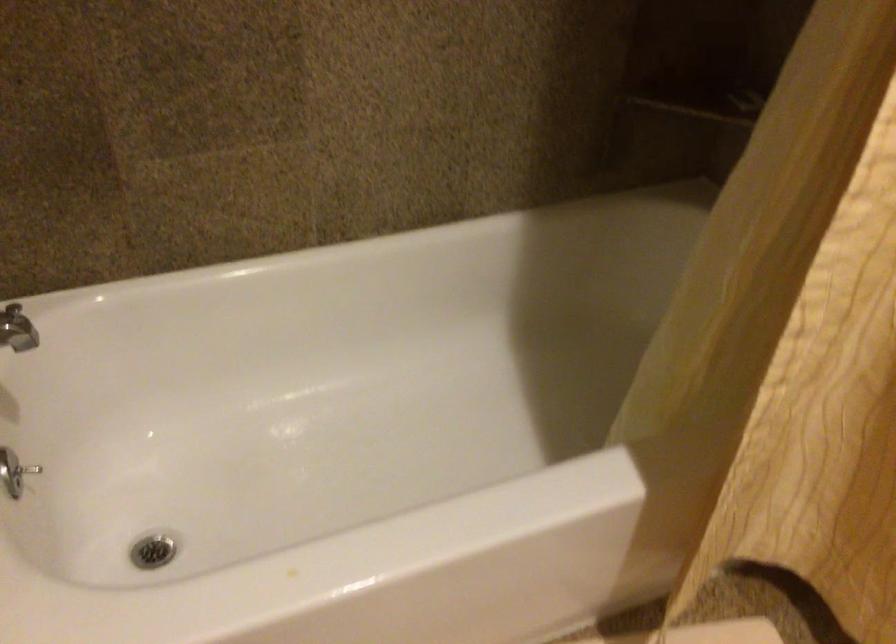
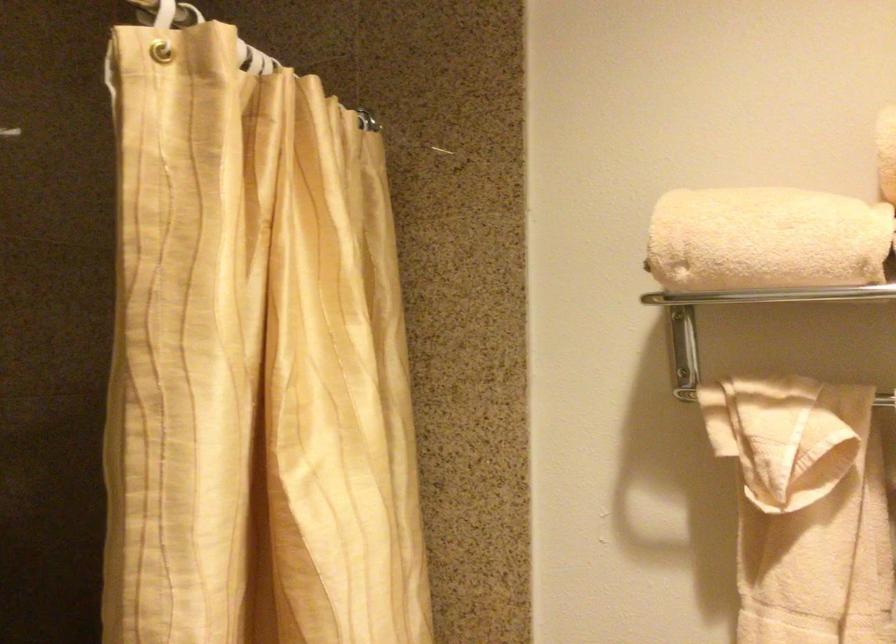
Based on the continuous images, in which direction is the camera rotating?

The camera rotated toward right-up.